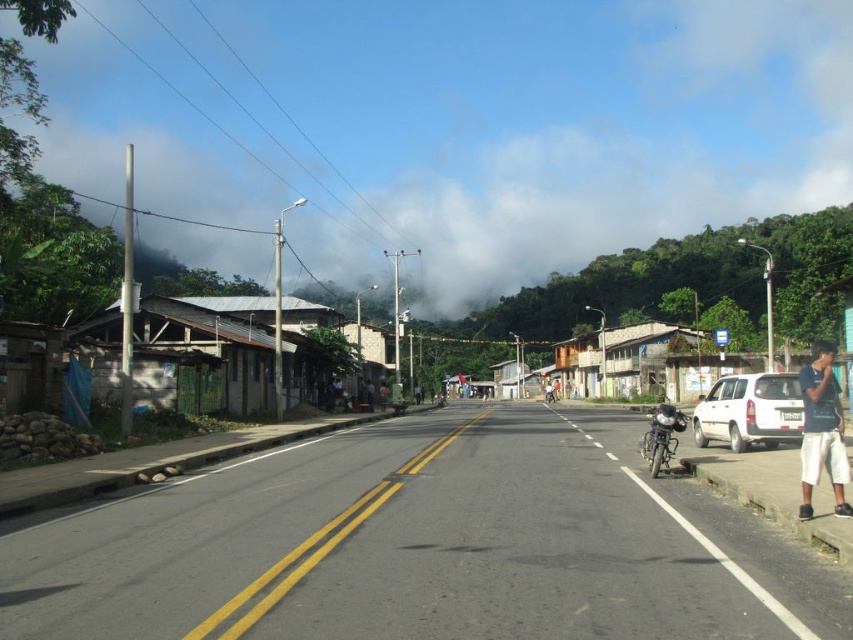
Question: Which object is closer to the camera taking this photo?

Choices:
 (A) shiny metallic motorcycle at center-right
 (B) white cotton shorts at lower right

Answer: (B)

Question: Which of the following is the farthest from the observer?

Choices:
 (A) (718, 397)
 (B) (647, 435)

Answer: (A)

Question: Which object is closer to the camera taking this photo?

Choices:
 (A) white cotton shorts at lower right
 (B) white matte suv at right

Answer: (A)

Question: Can you confirm if white matte suv at right is positioned to the right of shiny metallic motorcycle at center-right?

Choices:
 (A) yes
 (B) no

Answer: (A)

Question: Observing the image, what is the correct spatial positioning of white cotton shorts at lower right in reference to shiny metallic motorcycle at center-right?

Choices:
 (A) left
 (B) right

Answer: (B)

Question: Does white matte suv at right have a smaller size compared to shiny metallic motorcycle at center-right?

Choices:
 (A) yes
 (B) no

Answer: (A)